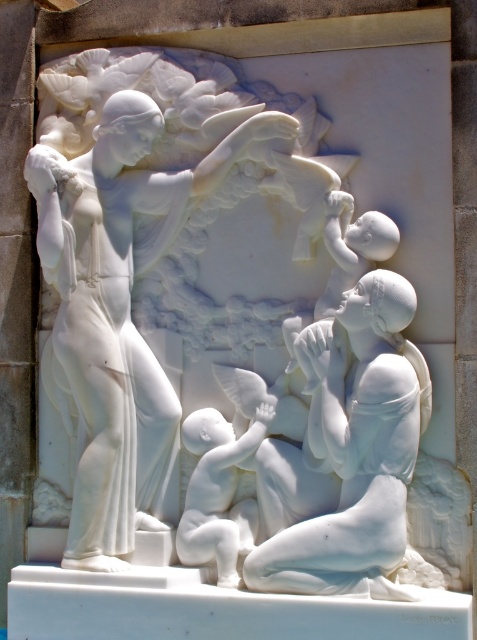
In the scene shown: You are an art conservator examining the marble relief sculpture. You notice the white marble statue at center and the matte white baby at lower center. Which object is positioned closer to your viewpoint?

The white marble statue at center is closer to the viewer than the matte white baby at lower center.

You are an art conservator examining the marble relief sculpture. You notice two points of concern on the sculpture. The first point is at coordinates point (394, 280), and the second is at point (230, 579). Which point would you reach first if you were to move from the front of the sculpture towards the back?

Point (394, 280) is in front of point (230, 579), so you would reach point (394, 280) first when moving from the front towards the back of the sculpture.